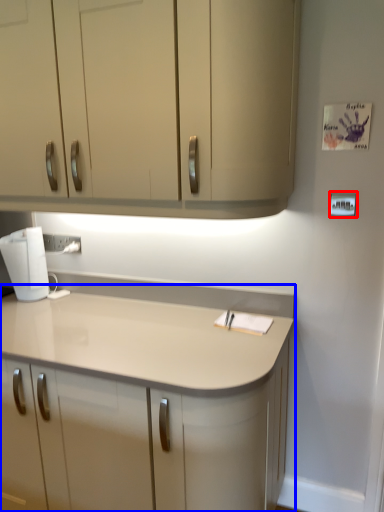
Question: Which of the following is the farthest to the observer, light switch (highlighted by a red box) or countertop (highlighted by a blue box)?

Choices:
 (A) light switch
 (B) countertop

Answer: (A)